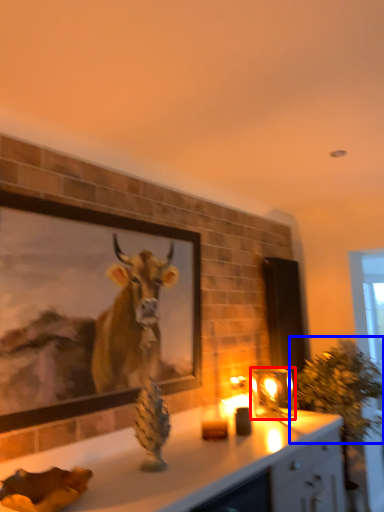
Question: Among these objects, which one is nearest to the camera, candle holder (highlighted by a red box) or plant (highlighted by a blue box)?

Choices:
 (A) candle holder
 (B) plant

Answer: (B)